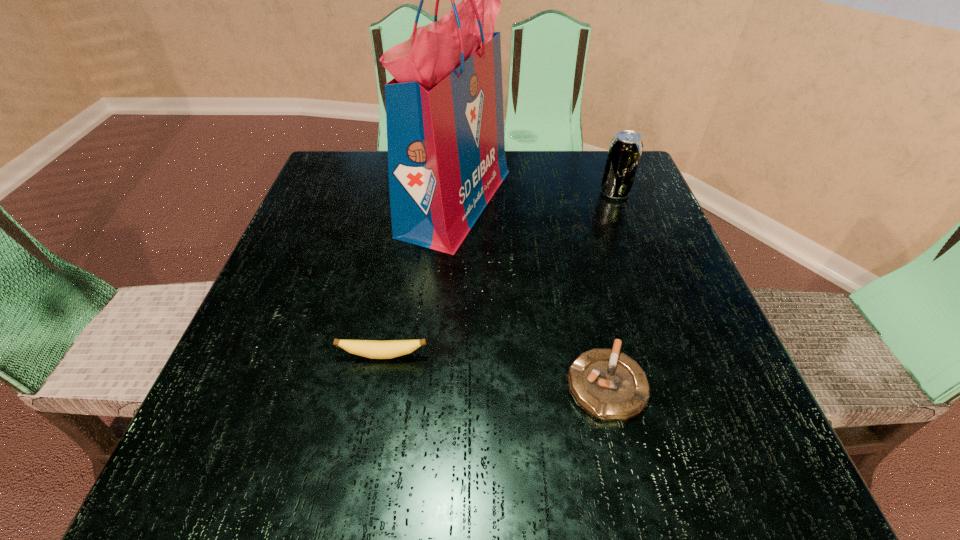
You are a GUI agent. You are given a task and a screenshot of the screen. Output one action in this format:
    pyautogui.click(x=<x>, y=<y>)
    Task: Click on the grocery bag
    
    Given the screenshot: What is the action you would take?
    pyautogui.click(x=444, y=108)

The width and height of the screenshot is (960, 540). Identify the location of the rightmost object. (625, 149).

Where is `soda can`? Image resolution: width=960 pixels, height=540 pixels. soda can is located at coordinates (625, 149).

The image size is (960, 540). I want to click on banana, so click(x=374, y=349).

Where is `the second object from right to left`? the second object from right to left is located at coordinates (610, 386).

The width and height of the screenshot is (960, 540). In order to click on ashtray in this screenshot , I will do `click(610, 386)`.

Locate an element on the screen. vacant point located on the front-facing side of the tallest object is located at coordinates (612, 201).

Find the location of `vacant region located 0.380m on the front of the third shortest object`. vacant region located 0.380m on the front of the third shortest object is located at coordinates (671, 342).

Identify the location of free spot located on the back of the second shortest object. The width and height of the screenshot is (960, 540). (405, 238).

Identify the location of free space located on the right of the ashtray. The image size is (960, 540). (733, 384).